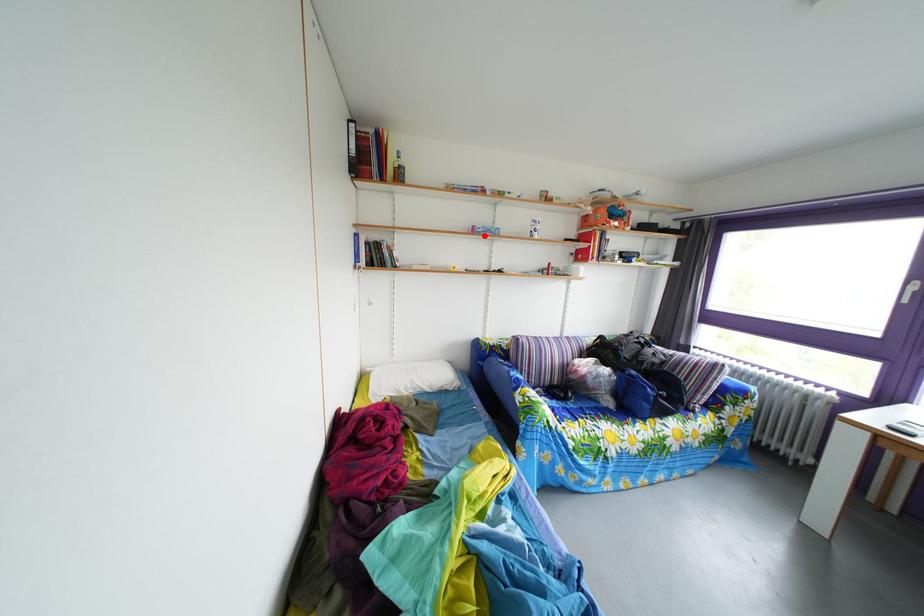
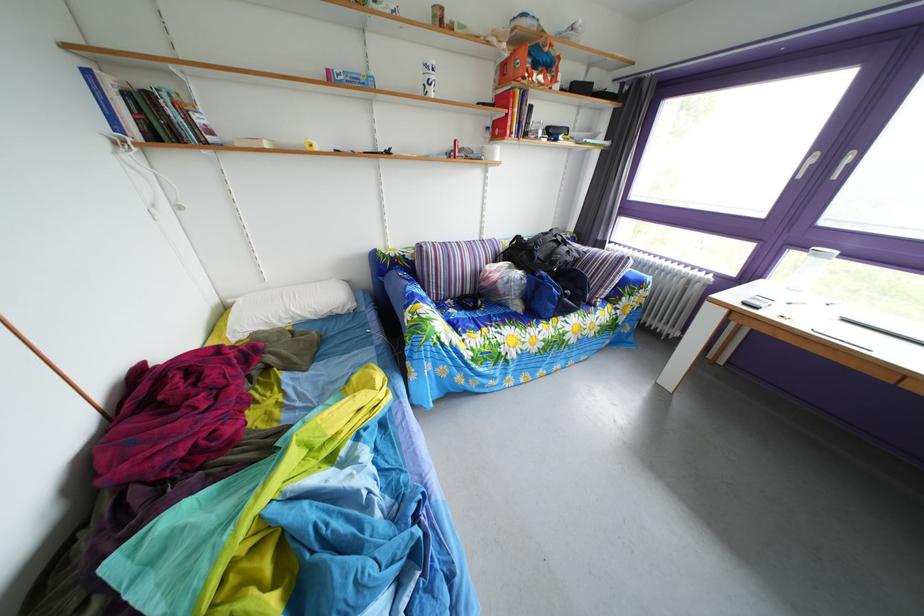
Locate, in the second image, the point that corresponds to the highlighted location in the first image.

(339, 79)